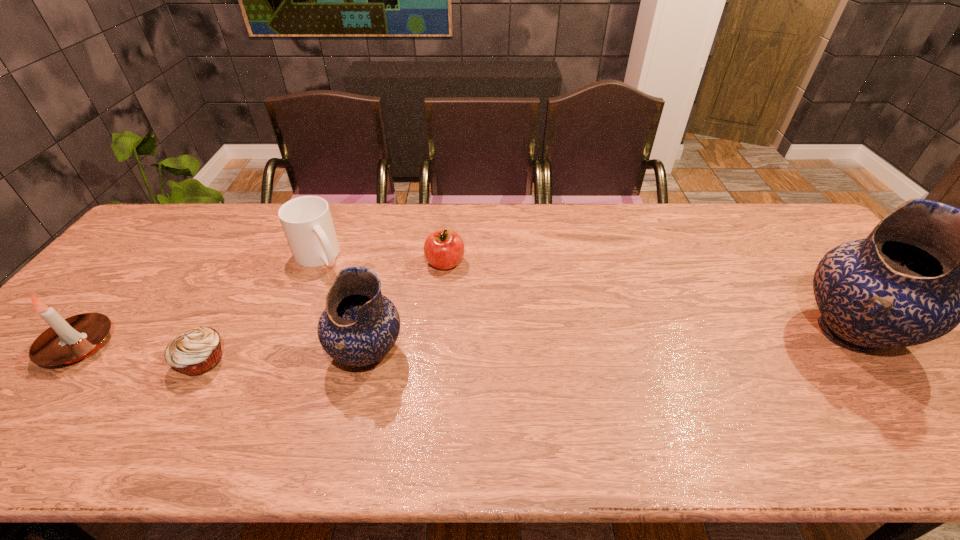
You are a GUI agent. You are given a task and a screenshot of the screen. Output one action in this format:
    pyautogui.click(x=<x>, y=<y>)
    Task: Click on the left pottery
    The image size is (960, 540).
    Given the screenshot: What is the action you would take?
    pyautogui.click(x=359, y=326)

Image resolution: width=960 pixels, height=540 pixels. I want to click on the third object from right to left, so click(359, 326).

Locate an element on the screen. the tallest object is located at coordinates (927, 266).

At what (x,y) coordinates should I click in order to perform the action: click on the rightmost object. Please return your answer as a coordinate pair (x, y). The height and width of the screenshot is (540, 960). Looking at the image, I should click on (927, 266).

The width and height of the screenshot is (960, 540). I want to click on the third object from left to right, so click(x=307, y=223).

In order to click on apple in this screenshot , I will do `click(444, 249)`.

Locate an element on the screen. The image size is (960, 540). the fifth tallest object is located at coordinates (444, 249).

At what (x,y) coordinates should I click in order to perform the action: click on the leftmost object. Please return your answer as a coordinate pair (x, y). This screenshot has width=960, height=540. Looking at the image, I should click on (69, 340).

Where is `the fifth object from right to left`? the fifth object from right to left is located at coordinates (196, 351).

This screenshot has height=540, width=960. I want to click on the shortest object, so click(x=196, y=351).